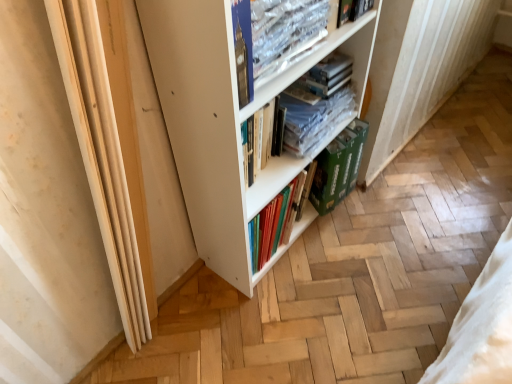
Question: Does white matte bookcase at center have a lesser height compared to green cardboard box at lower center?

Choices:
 (A) yes
 (B) no

Answer: (B)

Question: Is white matte bookcase at center looking in the opposite direction of green cardboard box at lower center?

Choices:
 (A) yes
 (B) no

Answer: (A)

Question: Is white matte bookcase at center facing towards green cardboard box at lower center?

Choices:
 (A) yes
 (B) no

Answer: (A)

Question: Is white matte bookcase at center further to the viewer compared to green cardboard box at lower center?

Choices:
 (A) yes
 (B) no

Answer: (B)

Question: Is the position of white matte bookcase at center less distant than that of green cardboard box at lower center?

Choices:
 (A) no
 (B) yes

Answer: (B)

Question: Is white matte bookcase at center positioned far away from green cardboard box at lower center?

Choices:
 (A) yes
 (B) no

Answer: (B)

Question: Can you confirm if white matte bookcase at center is wider than clear plastic books at center, acting as the first book starting from the back?

Choices:
 (A) no
 (B) yes

Answer: (B)

Question: Is white matte bookcase at center touching clear plastic books at center, acting as the first book starting from the back?

Choices:
 (A) no
 (B) yes

Answer: (A)

Question: Does white matte bookcase at center turn towards clear plastic books at center, the 3th book from the front?

Choices:
 (A) yes
 (B) no

Answer: (A)

Question: Considering the relative sizes of white matte bookcase at center and clear plastic books at center, the 3th book from the front, in the image provided, is white matte bookcase at center thinner than clear plastic books at center, the 3th book from the front,?

Choices:
 (A) no
 (B) yes

Answer: (A)

Question: From a real-world perspective, is white matte bookcase at center under clear plastic books at center, the 3th book from the front?

Choices:
 (A) no
 (B) yes

Answer: (A)

Question: Does white matte bookcase at center have a larger size compared to clear plastic books at center, acting as the first book starting from the back?

Choices:
 (A) yes
 (B) no

Answer: (A)

Question: Is clear plastic book at upper center, acting as the 3th book starting from the back, with white matte bookcase at center?

Choices:
 (A) no
 (B) yes

Answer: (A)